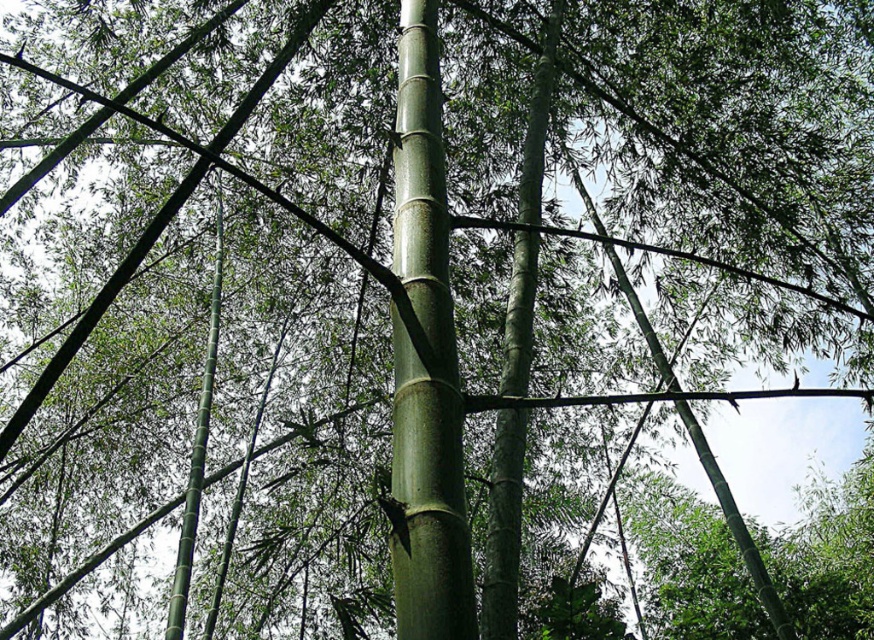
You are standing in the dense bamboo forest and want to locate the green matte bamboo at center. According to the coordinates provided, where exactly would you find it?

The green matte bamboo at center is located at point (425, 360), which corresponds to the central area of the image based on the coordinates given.

You are a bird flying through the bamboo forest and need to land on the green matte bamboo at center and the green smooth bamboo at center. Which one is on the right side from your perspective?

The green matte bamboo at center is positioned on the right side of the green smooth bamboo at center, so from your perspective, the green matte bamboo at center is on the right side.

You are standing in the bamboo forest and want to identify the bamboo at the center. Which one is higher positioned between the green matte bamboo at center and the green smooth bamboo at center?

The green matte bamboo at center is positioned over the green smooth bamboo at center, so it is higher.